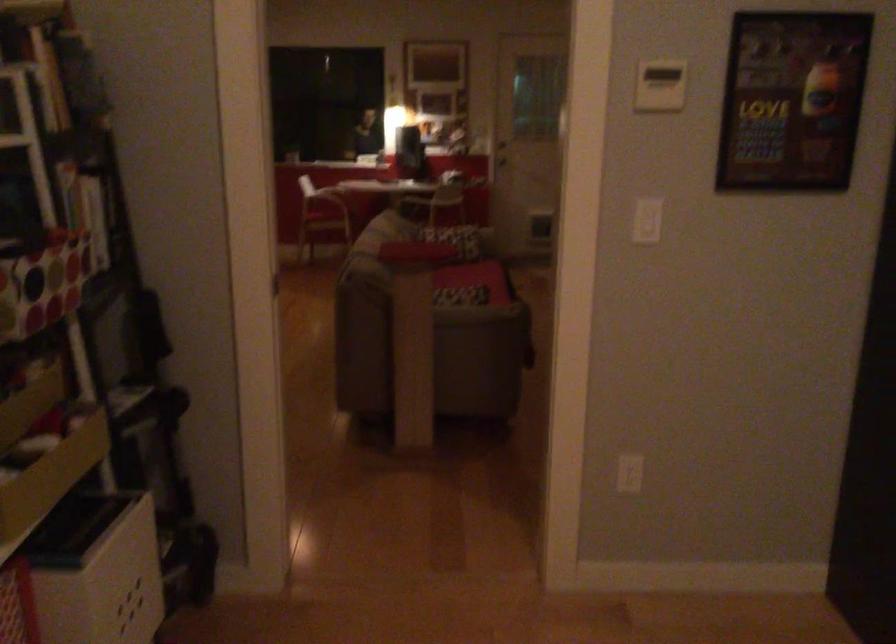
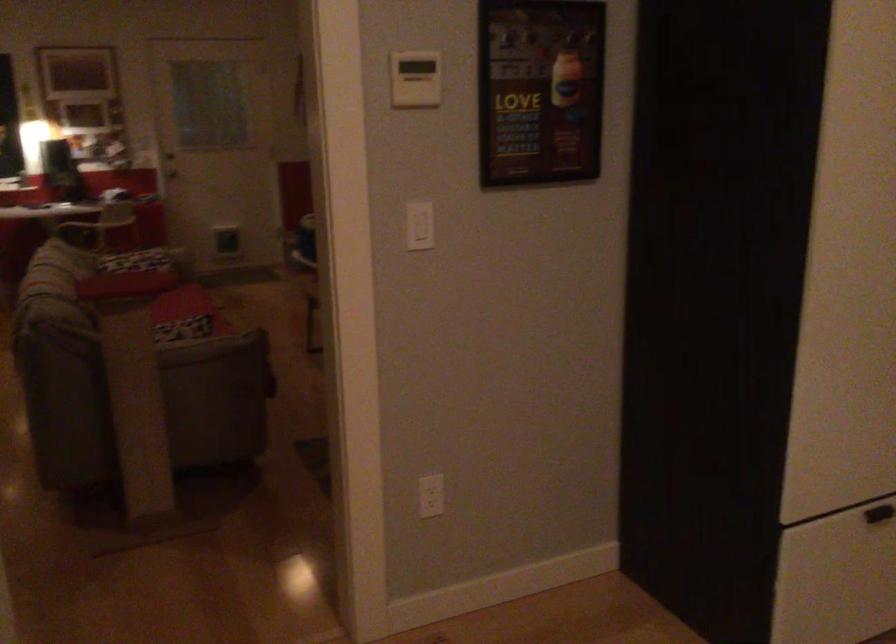
Locate, in the second image, the point that corresponds to point 647,223 in the first image.

(419, 225)